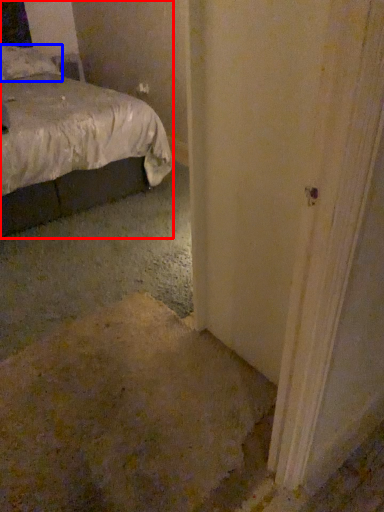
Question: Which point is further to the camera, bed (highlighted by a red box) or pillow (highlighted by a blue box)?

Choices:
 (A) bed
 (B) pillow

Answer: (B)